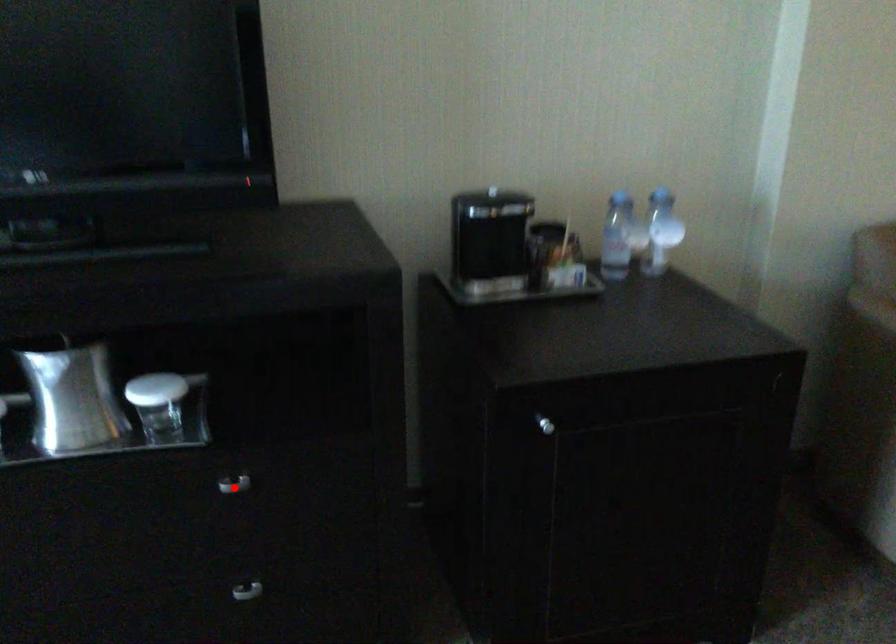
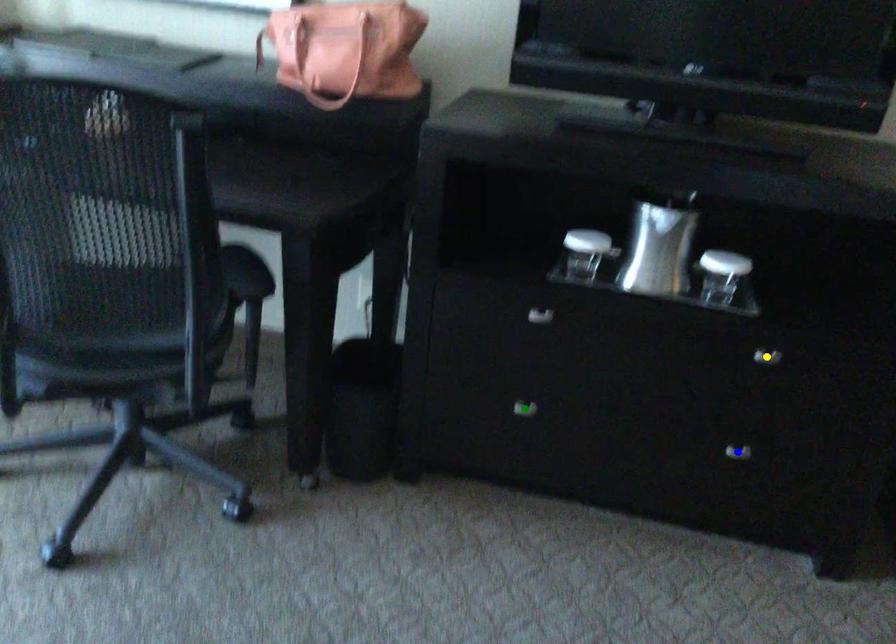
Question: I am providing you with two images of the same scene from different viewpoints. A red point is marked on the first image. You are given multiple points on the second image. Which point in image 2 is actually the same real-world point as the red point in image 1?

Choices:
 (A) yellow point
 (B) green point
 (C) blue point

Answer: (A)